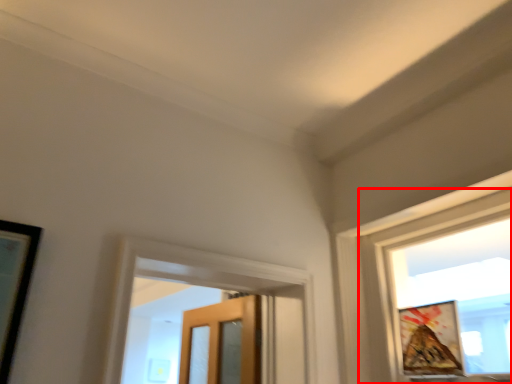
Question: From the image's perspective, what is the correct spatial relationship of window (annotated by the red box) in relation to picture frame?

Choices:
 (A) below
 (B) above

Answer: (B)